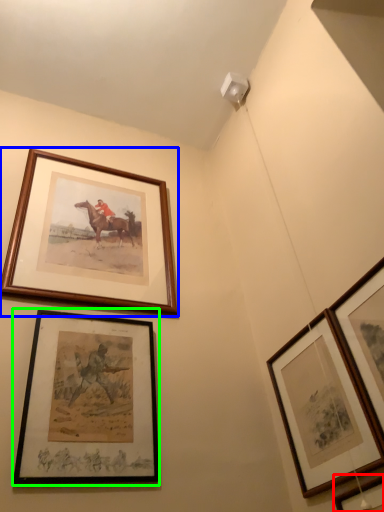
Question: Which object is positioned closest to picture frame (highlighted by a red box)? Select from picture frame (highlighted by a blue box) and picture frame (highlighted by a green box).

Choices:
 (A) picture frame
 (B) picture frame

Answer: (B)